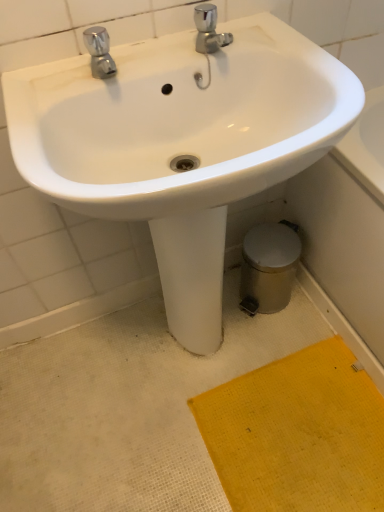
Identify the location of free space above yellow textured mat at lower right (from a real-world perspective). 304,428.